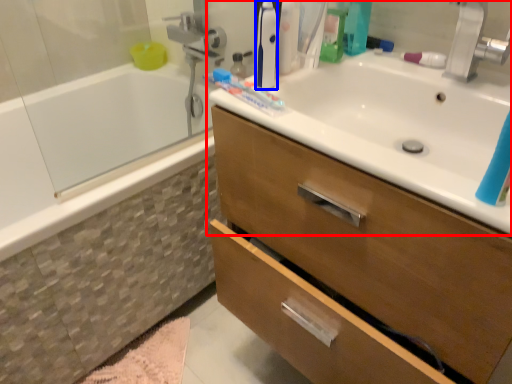
Question: Which object is closer to the camera taking this photo, sink (highlighted by a red box) or toiletry (highlighted by a blue box)?

Choices:
 (A) sink
 (B) toiletry

Answer: (A)